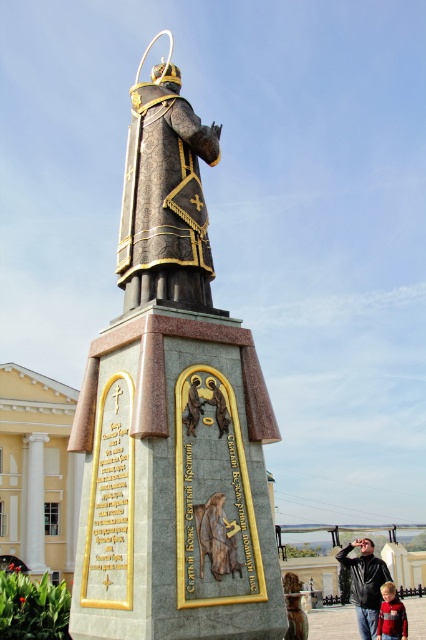
Is gold-bronze statue at center to the left of brown leather belt at lower center from the viewer's perspective?

Yes, gold-bronze statue at center is to the left of brown leather belt at lower center.

Which is in front, point (123, 566) or point (221, 566)?

Point (123, 566) is in front.

At what (x,y) coordinates should I click in order to perform the action: click on gold-bronze statue at center. Please return your answer as a coordinate pair (x, y). This screenshot has height=640, width=426. Looking at the image, I should click on (169, 410).

Between gold-bronze statue at center and goldmetallicstatue at center, which one is positioned higher?

gold-bronze statue at center is higher up.

Based on the photo, who is more distant from viewer, (210, 406) or (207, 385)?

The point (207, 385) is more distant.

Identify the location of gold-bronze statue at center. The image size is (426, 640). (169, 410).

Who is positioned more to the right, brown leather belt at lower center or red sweater at lower right?

red sweater at lower right is more to the right.

Is point (199, 506) more distant than point (388, 612)?

No, (199, 506) is closer to viewer.

The width and height of the screenshot is (426, 640). I want to click on brown leather belt at lower center, so click(216, 538).